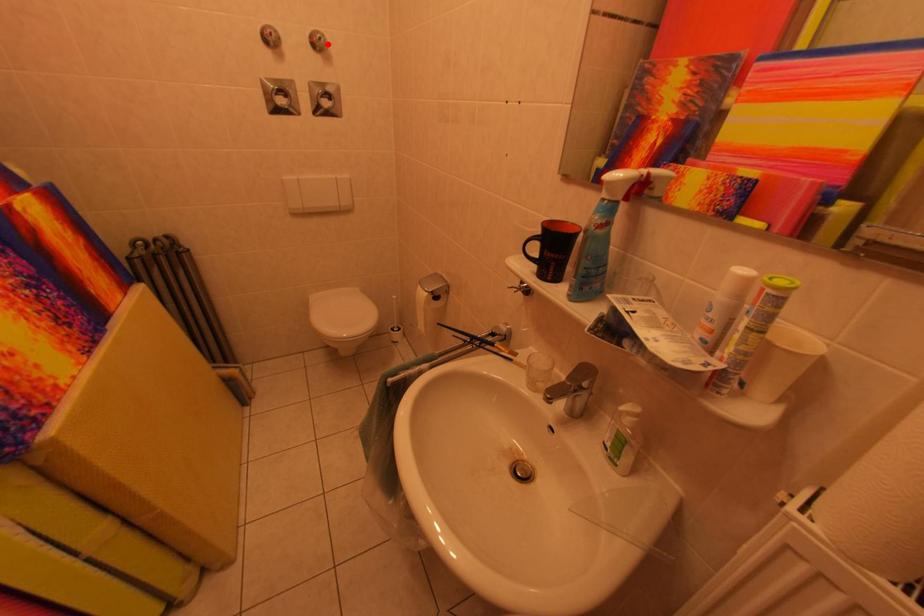
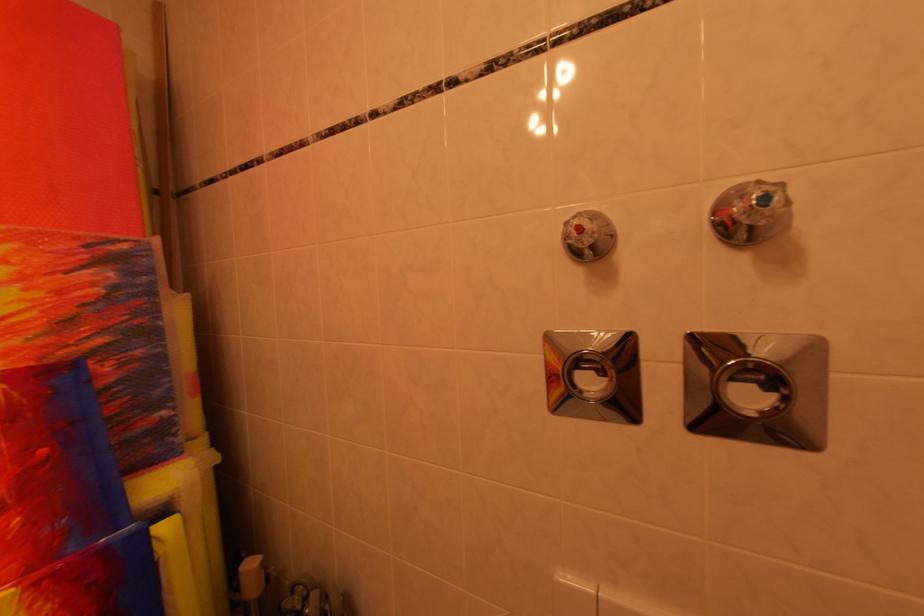
The point at the highlighted location is marked in the first image. Where is the corresponding point in the second image?

(773, 201)